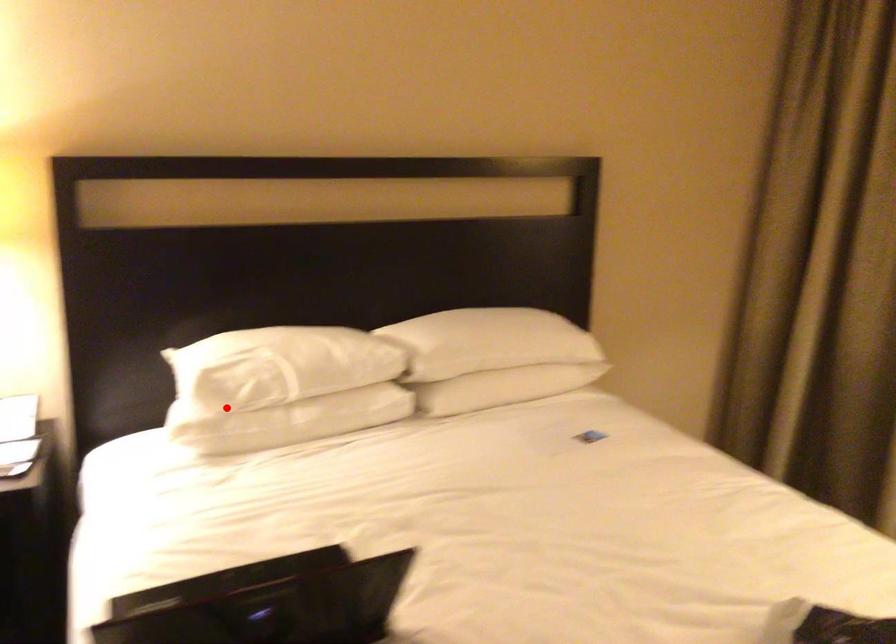
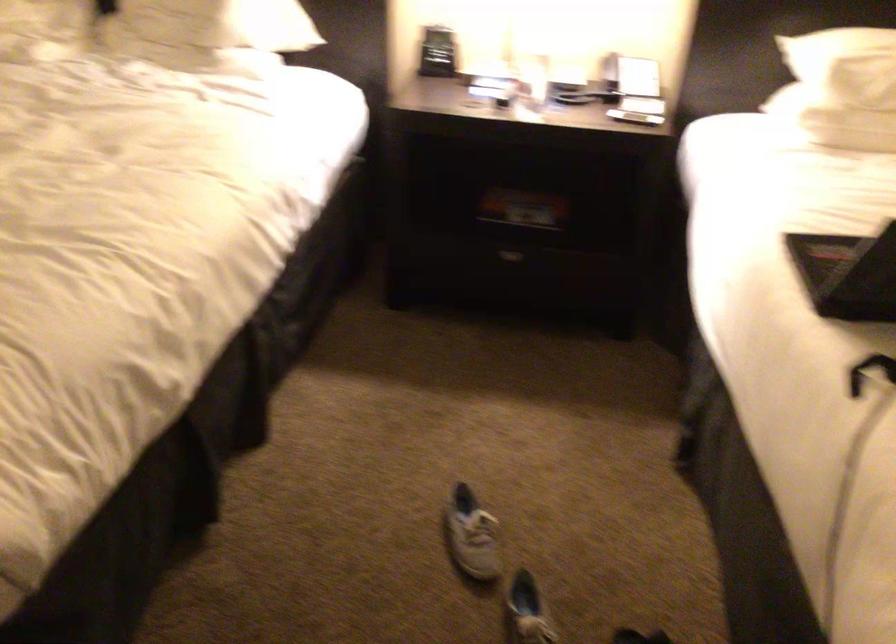
In the second image, find the point that corresponds to the highlighted location in the first image.

(858, 95)